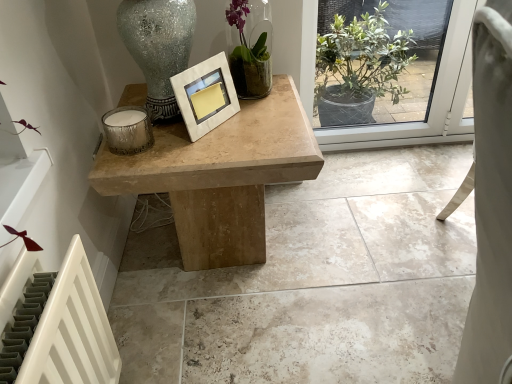
Question: Considering the relative sizes of metallic textured candle at left and natural wood table at center in the image provided, is metallic textured candle at left thinner than natural wood table at center?

Choices:
 (A) yes
 (B) no

Answer: (A)

Question: Is metallic textured candle at left positioned before natural wood table at center?

Choices:
 (A) yes
 (B) no

Answer: (B)

Question: Is metallic textured candle at left to the right of natural wood table at center from the viewer's perspective?

Choices:
 (A) yes
 (B) no

Answer: (B)

Question: From the image's perspective, does metallic textured candle at left appear higher than natural wood table at center?

Choices:
 (A) no
 (B) yes

Answer: (B)

Question: Is natural wood table at center at the back of metallic textured candle at left?

Choices:
 (A) no
 (B) yes

Answer: (A)

Question: Is green glass vase at upper center inside or outside of natural wood table at center?

Choices:
 (A) inside
 (B) outside

Answer: (B)

Question: Considering the positions of point (269, 74) and point (172, 134), is point (269, 74) closer or farther from the camera than point (172, 134)?

Choices:
 (A) closer
 (B) farther

Answer: (B)

Question: From their relative heights in the image, would you say green glass vase at upper center is taller or shorter than natural wood table at center?

Choices:
 (A) short
 (B) tall

Answer: (A)

Question: Is green glass vase at upper center wider or thinner than natural wood table at center?

Choices:
 (A) thin
 (B) wide

Answer: (A)

Question: Considering the relative positions of white marble picture frame at center and natural wood table at center in the image provided, is white marble picture frame at center to the left or to the right of natural wood table at center?

Choices:
 (A) right
 (B) left

Answer: (A)

Question: From the image's perspective, is white marble picture frame at center above or below natural wood table at center?

Choices:
 (A) above
 (B) below

Answer: (A)

Question: Is white marble picture frame at center in front of or behind natural wood table at center in the image?

Choices:
 (A) behind
 (B) front

Answer: (B)

Question: Is white marble picture frame at center inside the boundaries of natural wood table at center, or outside?

Choices:
 (A) outside
 (B) inside

Answer: (A)

Question: Does point (284, 107) appear closer or farther from the camera than point (301, 258)?

Choices:
 (A) closer
 (B) farther

Answer: (A)

Question: Considering their positions, is natural wood table at center located in front of or behind natural stone table at center?

Choices:
 (A) behind
 (B) front

Answer: (A)